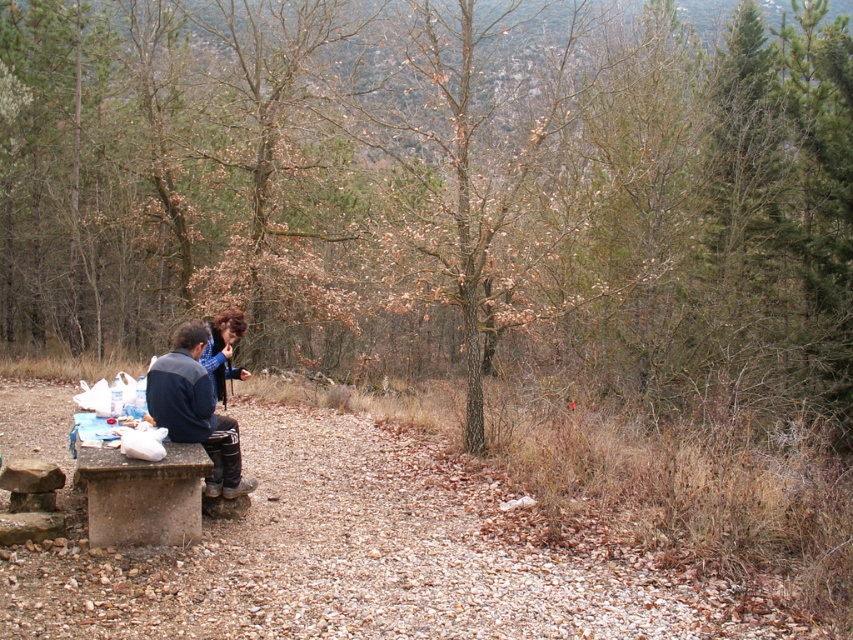
You are standing at the edge of the clearing and want to greet both the person in the dark blue jacket at left and the person in the matte blue shirt at center. Which person should you approach first to reach them more quickly?

You should approach the person in the dark blue jacket at left first because they are closer to you than the matte blue shirt at center, so you can reach them more quickly.

You are standing at the point marked as point (142, 496) in the image. What is the surface you are standing on?

The point (142, 496) is on concrete bench at lower left.